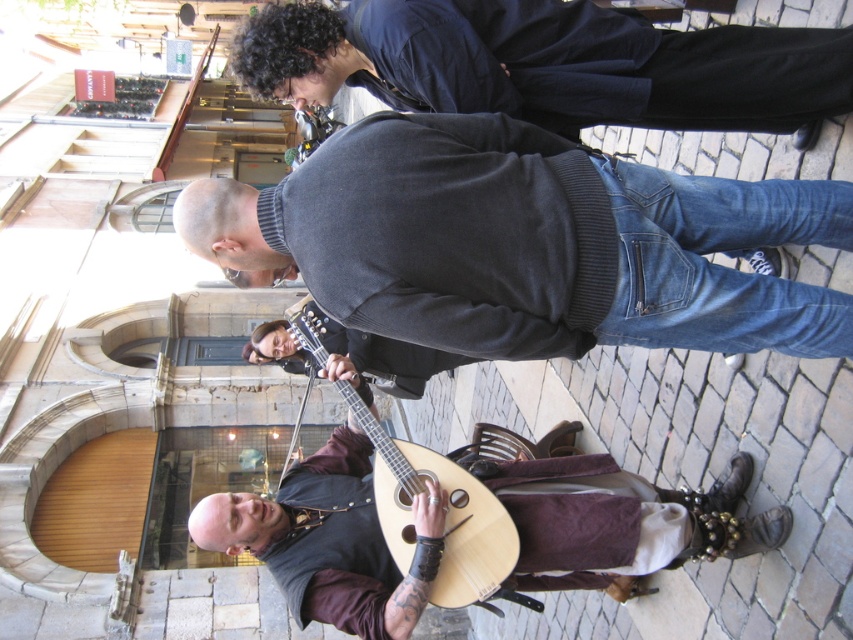
Does dark gray sweater at center have a lesser height compared to dark blue sweater at center?

Incorrect, dark gray sweater at center's height does not fall short of dark blue sweater at center's.

From the picture: Does dark gray sweater at center have a greater height compared to dark blue sweater at center?

Indeed, dark gray sweater at center has a greater height compared to dark blue sweater at center.

This screenshot has height=640, width=853. What do you see at coordinates (525, 243) in the screenshot?
I see `dark gray sweater at center` at bounding box center [525, 243].

I want to click on dark gray sweater at center, so click(x=525, y=243).

Can you confirm if dark blue sweater at center is positioned to the right of wooden mandolin at center?

Correct, you'll find dark blue sweater at center to the right of wooden mandolin at center.

Can you confirm if dark blue sweater at center is bigger than wooden mandolin at center?

Incorrect, dark blue sweater at center is not larger than wooden mandolin at center.

Where is `dark blue sweater at center`? dark blue sweater at center is located at coordinates pyautogui.click(x=547, y=64).

Find the location of a particular element. dark blue sweater at center is located at coordinates (547, 64).

Does wooden mandolin at center appear on the left side of wooden acoustic guitar at center?

In fact, wooden mandolin at center is to the right of wooden acoustic guitar at center.

The image size is (853, 640). Describe the element at coordinates (622, 522) in the screenshot. I see `wooden mandolin at center` at that location.

This screenshot has height=640, width=853. What are the coordinates of `wooden mandolin at center` in the screenshot? It's located at [622, 522].